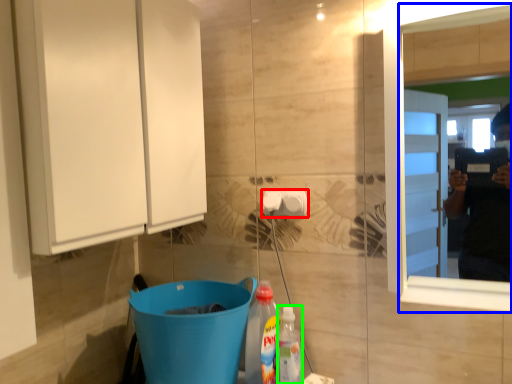
Question: Which is nearer to the towel bar (highlighted by a red box)? mirror (highlighted by a blue box) or cleaning product (highlighted by a green box).

Choices:
 (A) mirror
 (B) cleaning product

Answer: (B)